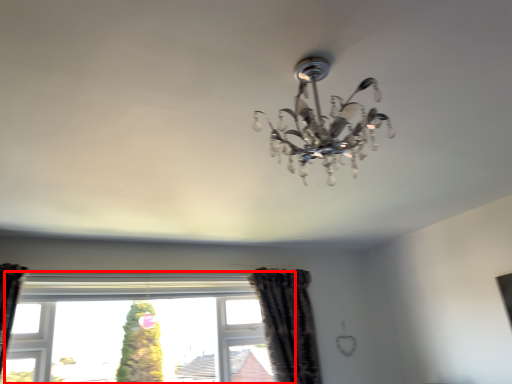
Question: Where is window (annotated by the red box) located in relation to curtain in the image?

Choices:
 (A) right
 (B) left

Answer: (B)